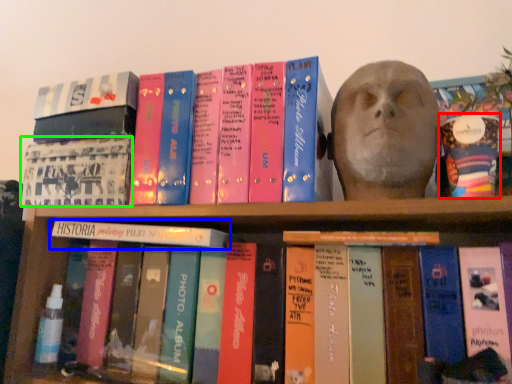
Question: Based on their relative distances, which object is farther from paperback book (highlighted by a red box)? Choose from book (highlighted by a blue box) and book cover (highlighted by a green box).

Choices:
 (A) book
 (B) book cover

Answer: (B)